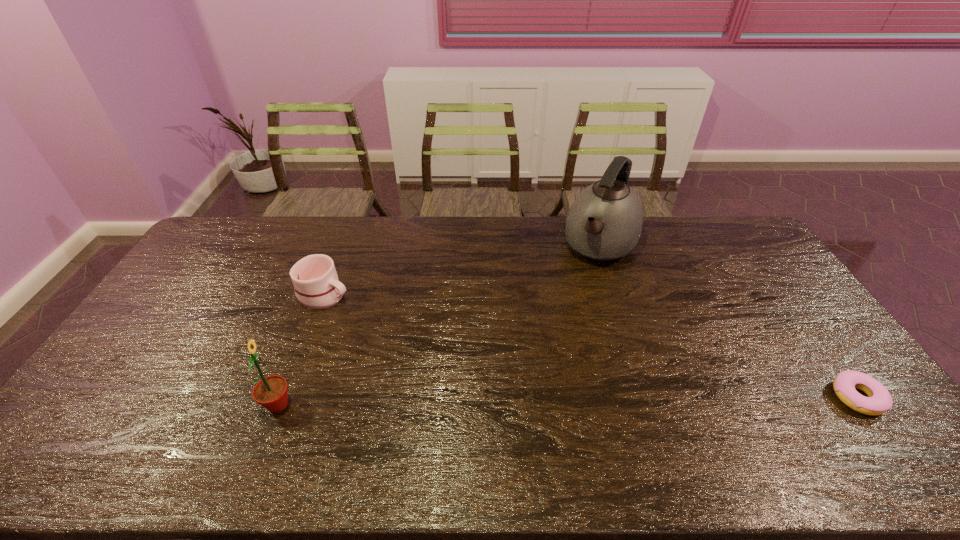
Where is `vacant position located 0.120m on the side with the handle of the mug`? The image size is (960, 540). vacant position located 0.120m on the side with the handle of the mug is located at coordinates click(x=374, y=315).

This screenshot has height=540, width=960. Identify the location of vacant space located 0.250m on the side with the handle of the mug. (408, 330).

Where is `free point located at the spout of the second object from right to left`? free point located at the spout of the second object from right to left is located at coordinates (584, 281).

Where is `vacant space located 0.260m at the spout of the second object from right to left`? vacant space located 0.260m at the spout of the second object from right to left is located at coordinates (561, 321).

Identify the location of vacant space located 0.080m at the spout of the second object from right to left. This screenshot has width=960, height=540. (581, 287).

Where is `object located at the far edge`? object located at the far edge is located at coordinates (604, 223).

In order to click on sunflower at the near edge in this screenshot , I will do `click(271, 392)`.

Identify the location of doughnut that is at the near edge. The height and width of the screenshot is (540, 960). (879, 400).

The height and width of the screenshot is (540, 960). I want to click on object situated at the right edge, so click(879, 400).

This screenshot has height=540, width=960. I want to click on object that is at the near right corner, so click(x=879, y=400).